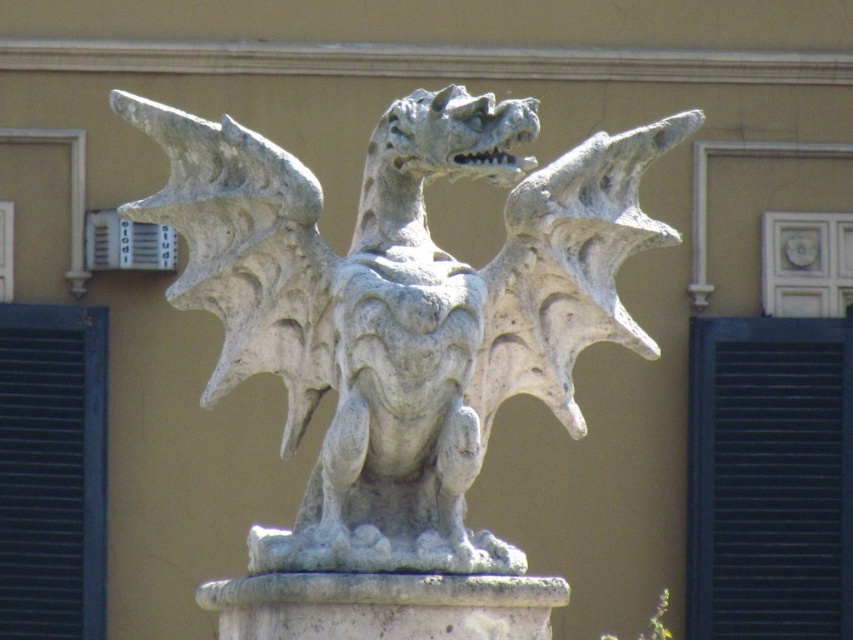
You are an architect inspecting a building facade. You observe the black matte shutter at right and the blue painted wood shutter at left. Which shutter is taller?

The blue painted wood shutter at left is taller than the black matte shutter at right.

You are standing in front of the dragon sculpture and want to take a photo of both the black matte shutter at right and the blue painted wood shutter at left. Which shutter should you focus on first to ensure both are in the frame?

You should focus on the black matte shutter at right first because it is closer to you than the blue painted wood shutter at left, so adjusting the camera to include both would require starting with the closer one.

You are an art conservator assessing the space for a new exhibition. The gray stone dragon at center and the blue painted wood shutter at left are both in the same room. If you need to move them to a new location with limited width, which object should you prioritize moving first based on their widths?

The gray stone dragon at center is wider than the blue painted wood shutter at left, so you should prioritize moving the blue painted wood shutter at left first since it is narrower and easier to fit through narrow spaces.